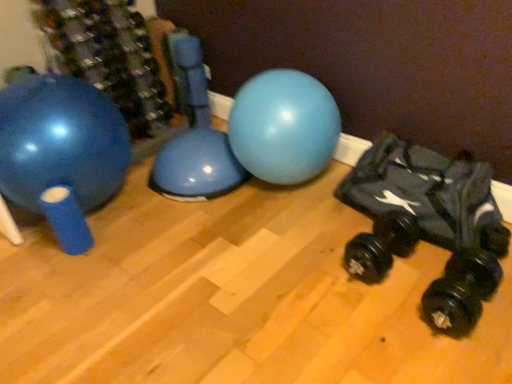
Question: From the image's perspective, is matte blue exercise ball at left located above or below black rubber dumbbell at lower right, the 1th dumbbell when ordered from right to left?

Choices:
 (A) below
 (B) above

Answer: (B)

Question: Is matte blue exercise ball at left spatially inside black rubber dumbbell at lower right, the 1th dumbbell when ordered from right to left, or outside of it?

Choices:
 (A) outside
 (B) inside

Answer: (A)

Question: Estimate the real-world distances between objects in this image. Which object is farther from the black rubber dumbbell at lower right, which is counted as the second dumbbell, starting from the left?

Choices:
 (A) black rubber dumbbell at lower right, arranged as the first dumbbell when viewed from the left
 (B) matte blue exercise ball at left

Answer: (B)

Question: Estimate the real-world distances between objects in this image. Which object is closer to the matte blue exercise ball at left?

Choices:
 (A) black rubber dumbbell at lower right, which is counted as the second dumbbell, starting from the left
 (B) black rubber dumbbell at lower right, acting as the second dumbbell starting from the right

Answer: (B)